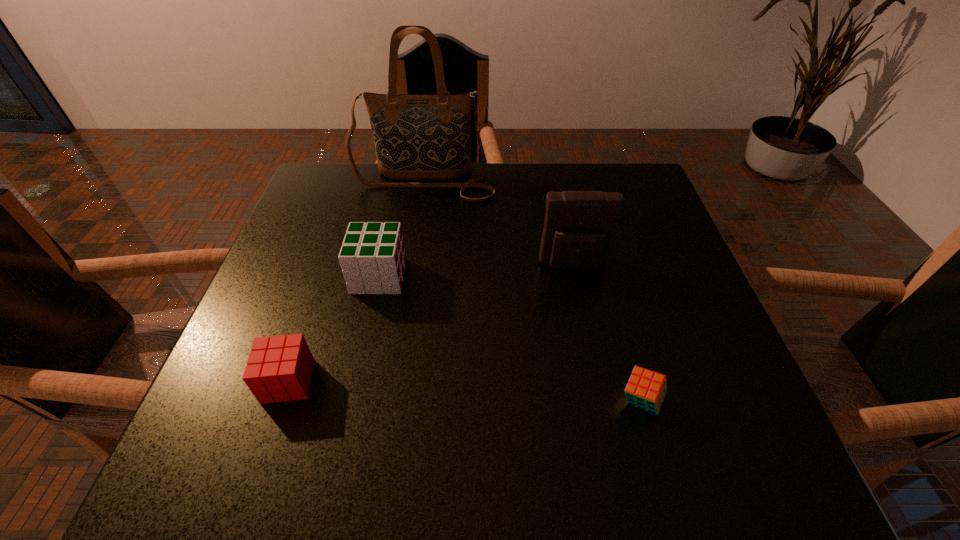
This screenshot has width=960, height=540. Find the location of `free space that satisfies the following two spatial constraints: 1. on the red face of the farthest cube; 2. on the back side of the rightmost cube`. free space that satisfies the following two spatial constraints: 1. on the red face of the farthest cube; 2. on the back side of the rightmost cube is located at coordinates (351, 401).

The image size is (960, 540). I want to click on free space in the image that satisfies the following two spatial constraints: 1. on the front-facing side of the tallest object; 2. on the red face of the farthest cube, so click(408, 276).

At what (x,y) coordinates should I click in order to perform the action: click on vacant space that satisfies the following two spatial constraints: 1. on the front-facing side of the tallest object; 2. on the right side of the rightmost cube. Please return your answer as a coordinate pair (x, y). This screenshot has width=960, height=540. Looking at the image, I should click on [x=389, y=401].

What are the coordinates of `blank area in the image that satisfies the following two spatial constraints: 1. on the red face of the farthest cube; 2. on the back side of the rightmost cube` in the screenshot? It's located at (351, 401).